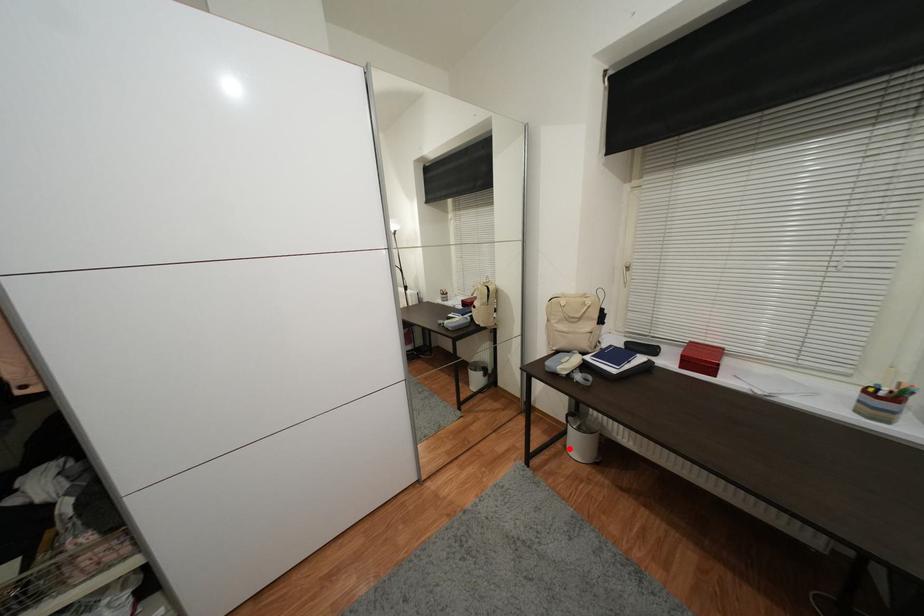
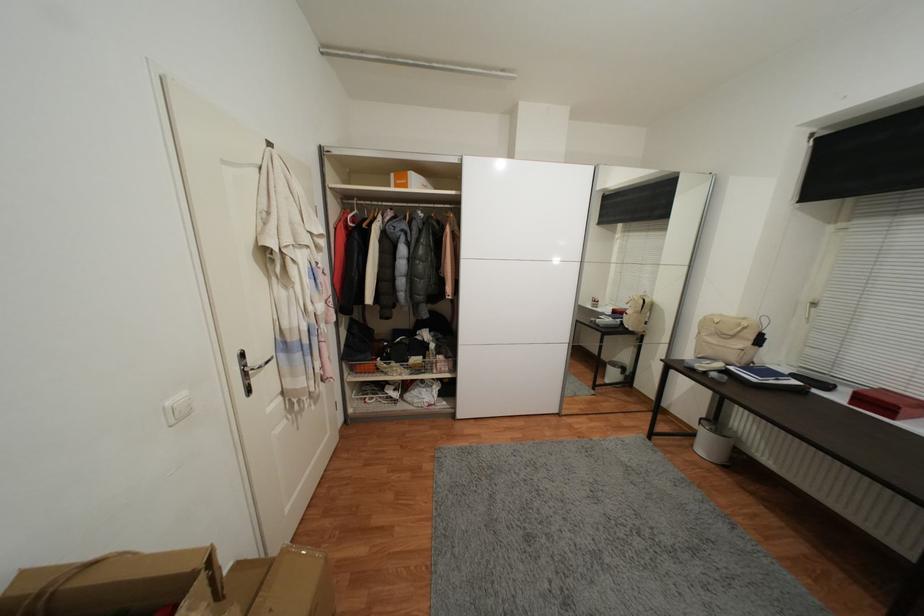
The point at the highlighted location is marked in the first image. Where is the corresponding point in the second image?

(697, 447)